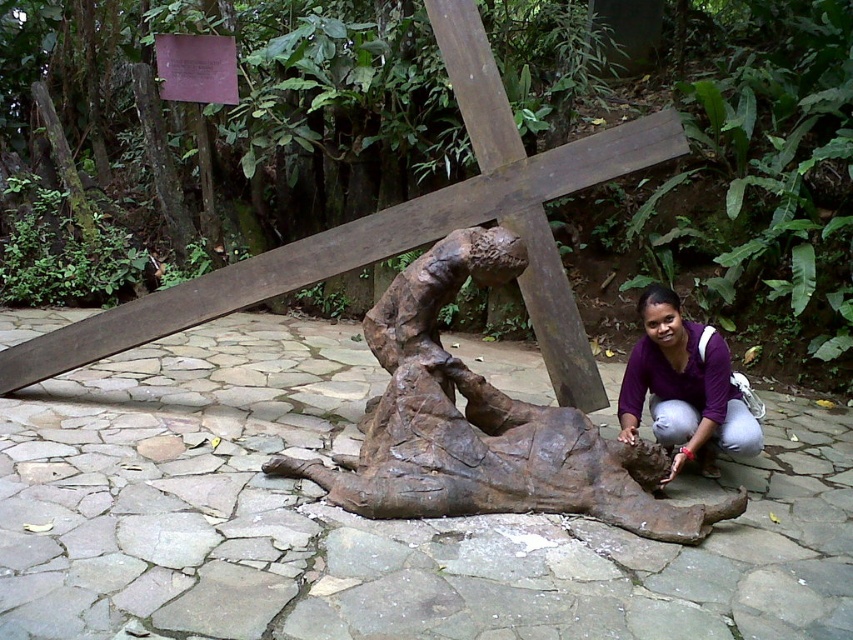
You are a visitor standing at the entrance of the outdoor area. You see the rusty metal sculpture at center and the purple matte shirt at lower right. Which object is located to the left of the other?

The rusty metal sculpture at center is positioned on the left side of purple matte shirt at lower right, so the sculpture is to the left of the shirt.

You are an art curator planning to display both the rusty metal sculpture at center and the rusty wood crucifix at center in a gallery. If you want to place them side by side, which object should be placed on the left to ensure they fit within a 2.5 meter wide display area?

The rusty metal sculpture at center has a lesser width compared to the rusty wood crucifix at center. To fit them within the 2.5 meter display area, place the narrower rusty metal sculpture at center on the left side first, followed by the wider rusty wood crucifix at center. This arrangement ensures optimal use of space while maintaining visibility of both artworks.

You are a photographer planning to take a wide shot of the rusty metal sculpture at center and the purple matte shirt at lower right. Which object should you focus on first to ensure both are fully captured in the frame?

The rusty metal sculpture at center has a larger width than the purple matte shirt at lower right, so you should focus on the rusty metal sculpture at center first to ensure both are fully captured in the frame.